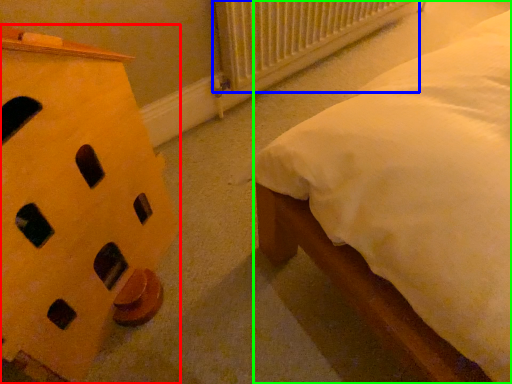
Question: Which object is the closest to the furniture (highlighted by a red box)? Choose among these: radiator (highlighted by a blue box) or nightstand (highlighted by a green box).

Choices:
 (A) radiator
 (B) nightstand

Answer: (B)